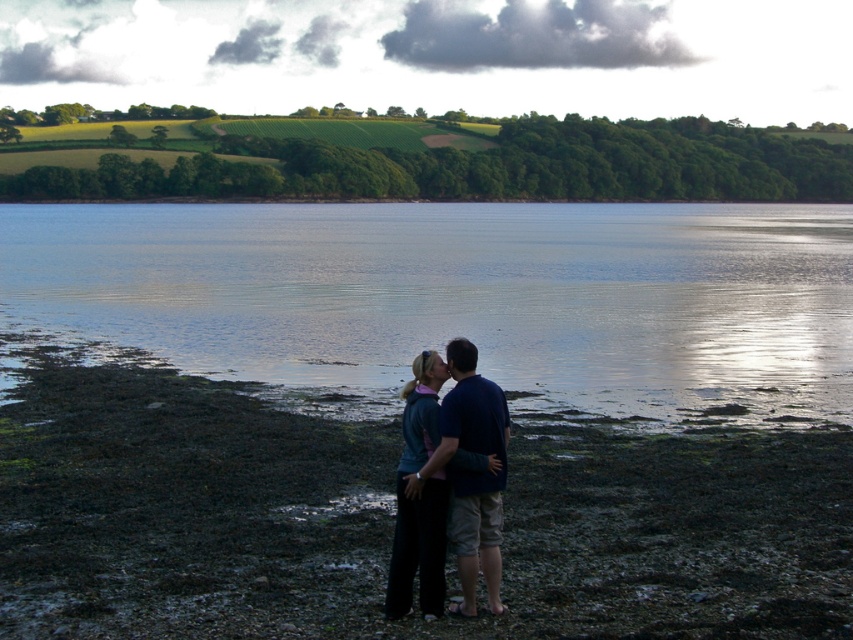
Between dull brown mud at lower center and dark blue fabric couple at center, which one is positioned higher?

dark blue fabric couple at center is higher up.

Consider the image. Is dull brown mud at lower center shorter than dark blue fabric couple at center?

Yes.

The width and height of the screenshot is (853, 640). I want to click on dull brown mud at lower center, so click(x=392, y=518).

Which is in front, point (268, 285) or point (462, 541)?

Point (462, 541)

Can you confirm if clear water at center is shorter than dark blue fabric couple at center?

Incorrect, clear water at center's height does not fall short of dark blue fabric couple at center's.

At what (x,y) coordinates should I click in order to perform the action: click on clear water at center. Please return your answer as a coordinate pair (x, y). The width and height of the screenshot is (853, 640). Looking at the image, I should click on (457, 298).

Who is more distant from viewer, (x=108, y=584) or (x=469, y=330)?

Positioned behind is point (x=469, y=330).

Is dull brown mud at lower center taller than clear water at center?

In fact, dull brown mud at lower center may be shorter than clear water at center.

Is point (585, 627) in front of point (767, 291)?

Yes, point (585, 627) is in front of point (767, 291).

In order to click on dull brown mud at lower center in this screenshot , I will do `click(392, 518)`.